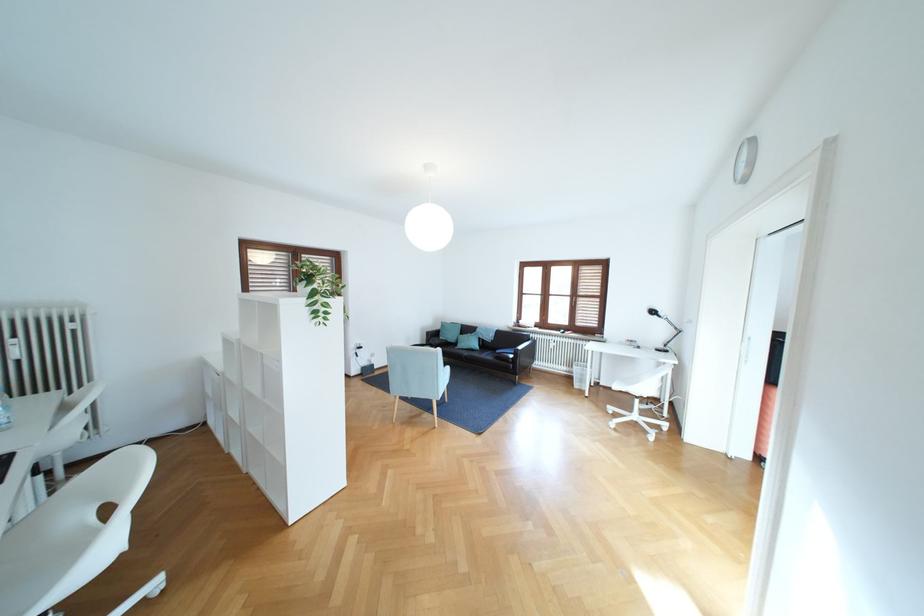
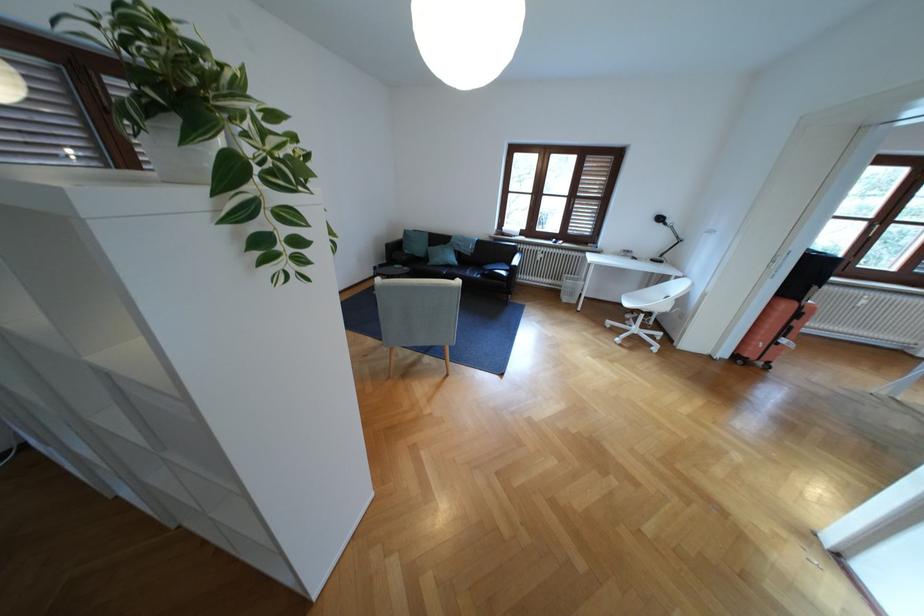
In the second image, find the point that corresponds to pixel 667 350 in the first image.

(663, 261)